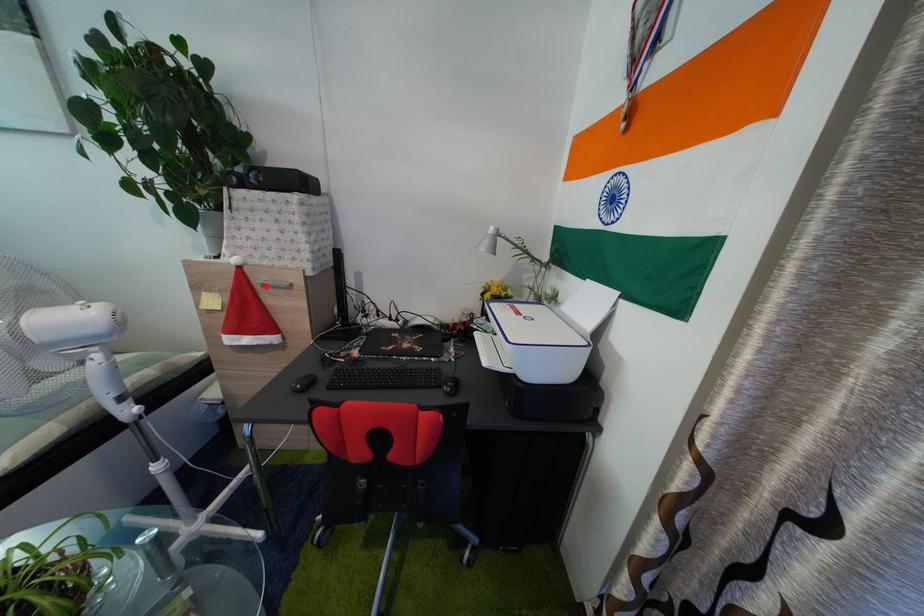
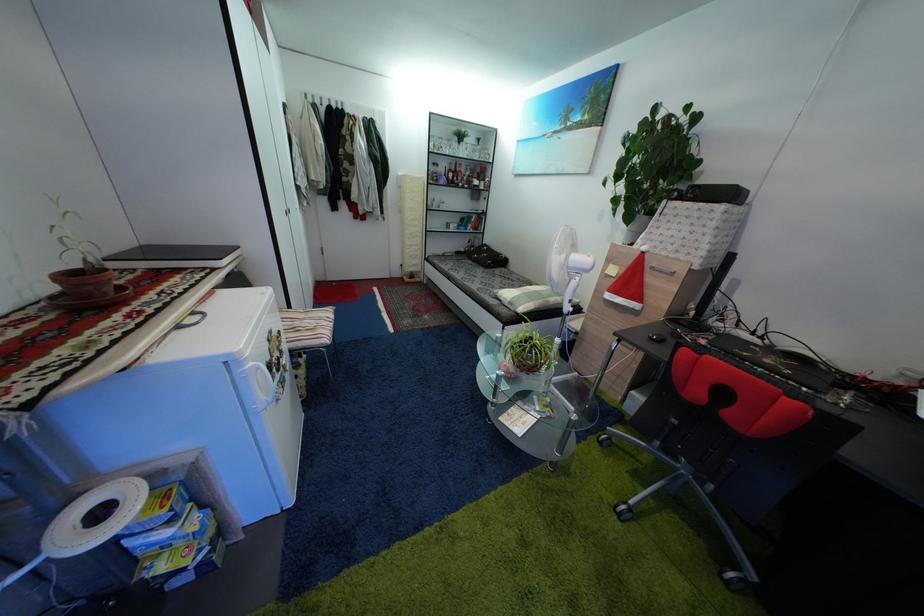
The point at the highlighted location is marked in the first image. Where is the corresponding point in the second image?

(659, 270)